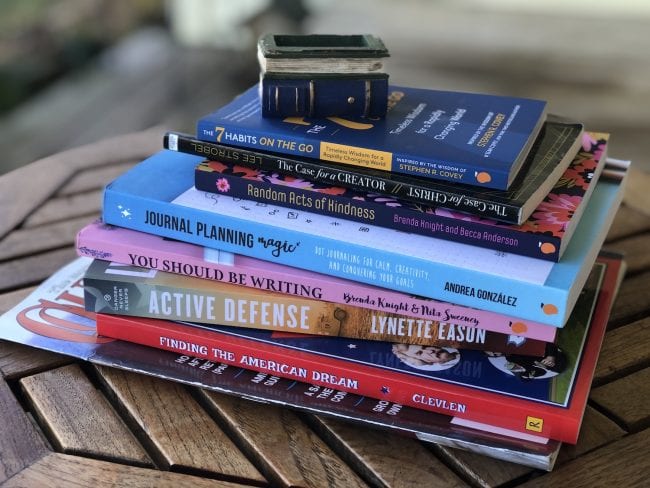
Locate an element on the screen. This screenshot has width=650, height=488. book is located at coordinates (273, 364), (265, 323), (268, 280), (291, 249), (339, 206), (358, 184), (398, 157).